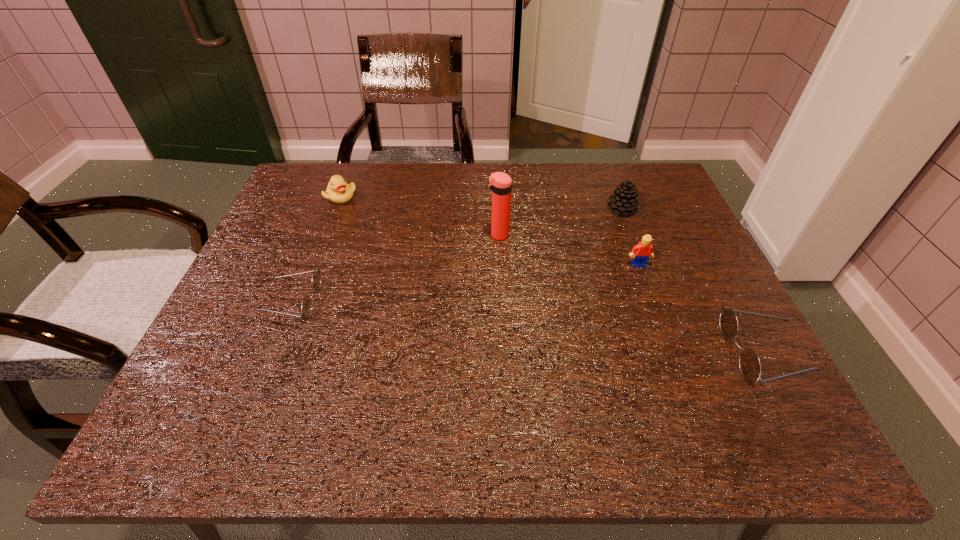
At what (x,y) coordinates should I click in order to perform the action: click on vacant space that's between the third farthest object and the pinecone. Please return your answer as a coordinate pair (x, y). The width and height of the screenshot is (960, 540). Looking at the image, I should click on (560, 222).

At what (x,y) coordinates should I click in order to perform the action: click on object that can be found as the third closest to the right spectacles. Please return your answer as a coordinate pair (x, y). Looking at the image, I should click on (500, 183).

Find the location of a particular element. Image resolution: width=960 pixels, height=540 pixels. object that stands as the third closest to the pinecone is located at coordinates (750, 367).

Find the location of a particular element. The height and width of the screenshot is (540, 960). free space that satisfies the following two spatial constraints: 1. on the front-facing side of the duckling; 2. on the left side of the fourth object from right to left is located at coordinates (325, 235).

The height and width of the screenshot is (540, 960). Find the location of `vacant position in the image that satisfies the following two spatial constraints: 1. on the front side of the fourth object from right to left; 2. on the front-facing side of the shorter spectacles`. vacant position in the image that satisfies the following two spatial constraints: 1. on the front side of the fourth object from right to left; 2. on the front-facing side of the shorter spectacles is located at coordinates (501, 302).

I want to click on vacant space that satisfies the following two spatial constraints: 1. at the narrow end of the pinecone; 2. on the front-facing side of the left spectacles, so click(657, 302).

At what (x,y) coordinates should I click in order to perform the action: click on vacant region that satisfies the following two spatial constraints: 1. on the front-facing side of the tallest object; 2. on the left side of the duckling. Please return your answer as a coordinate pair (x, y). Looking at the image, I should click on (325, 235).